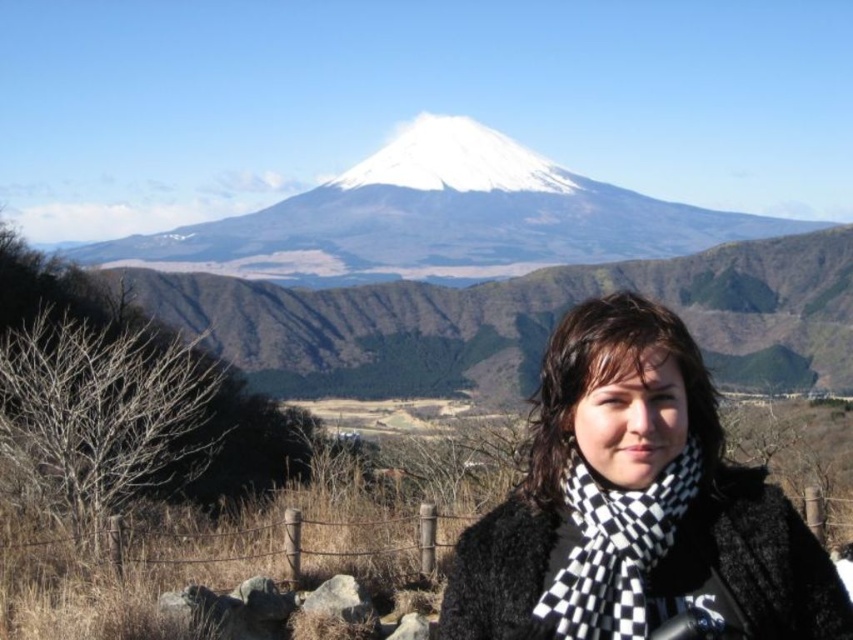
Find the location of a particular element. This screenshot has height=640, width=853. white snow-covered mountain at upper center is located at coordinates (438, 220).

Between white snow-covered mountain at upper center and black checkered scarf at lower right, which one has less height?

black checkered scarf at lower right

Which is in front, point (264, 216) or point (598, 500)?

Point (598, 500) is more forward.

Locate an element on the screen. The height and width of the screenshot is (640, 853). white snow-covered mountain at upper center is located at coordinates (438, 220).

Is black checkered scarf at center thinner than white snow-covered mountain at upper center?

Yes.

Is point (556, 520) positioned before point (248, 262)?

Yes.

Between point (473, 602) and point (241, 250), which one is positioned in front?

Point (473, 602)

This screenshot has width=853, height=640. In order to click on black checkered scarf at center in this screenshot , I will do `click(636, 506)`.

Between black checkered scarf at center and black checkered scarf at lower right, which one is positioned higher?

black checkered scarf at lower right is higher up.

This screenshot has height=640, width=853. What do you see at coordinates (636, 506) in the screenshot?
I see `black checkered scarf at center` at bounding box center [636, 506].

Find the location of `black checkered scarf at center`. black checkered scarf at center is located at coordinates (636, 506).